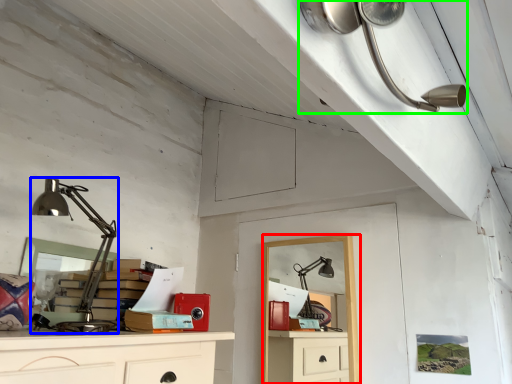
Question: Based on their relative distances, which object is nearer to computer desk (highlighted by a red box)? Choose from lamp (highlighted by a blue box) and lamp (highlighted by a green box).

Choices:
 (A) lamp
 (B) lamp

Answer: (A)